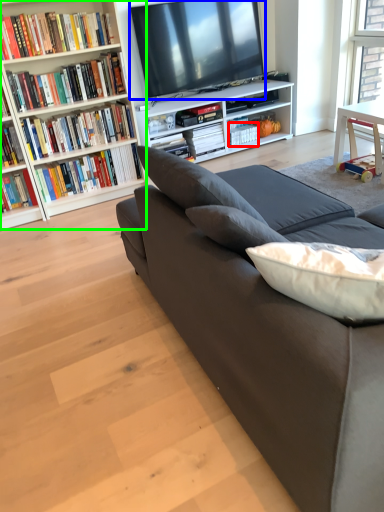
Question: Which object is the closest to the book (highlighted by a red box)? Choose among these: television (highlighted by a blue box) or bookcase (highlighted by a green box).

Choices:
 (A) television
 (B) bookcase

Answer: (A)